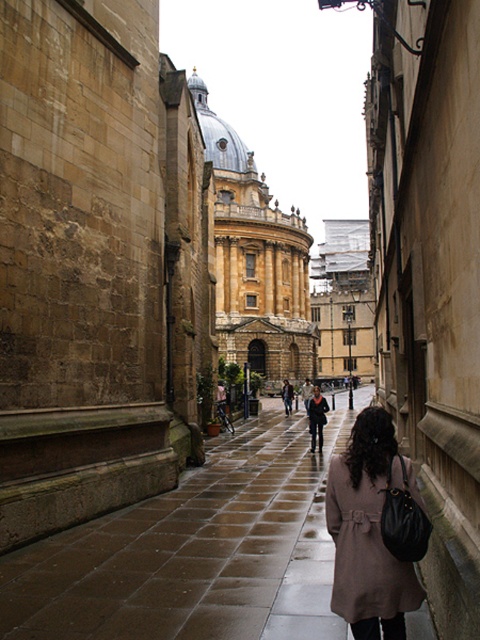
Is brown matte trench coat at lower right below matte black coat at center?

No.

Does brown matte trench coat at lower right have a greater height compared to matte black coat at center?

Yes, brown matte trench coat at lower right is taller than matte black coat at center.

Who is more forward, (381, 444) or (324, 401)?

Point (381, 444) is in front.

At what (x,y) coordinates should I click in order to perform the action: click on brown matte trench coat at lower right. Please return your answer as a coordinate pair (x, y). Looking at the image, I should click on (374, 531).

Does golden stone dome at center have a larger size compared to brown matte trench coat at lower right?

Yes, golden stone dome at center is bigger than brown matte trench coat at lower right.

Does point (232, 198) lie in front of point (408, 486)?

No, (232, 198) is further to viewer.

This screenshot has height=640, width=480. I want to click on golden stone dome at center, so click(x=255, y=260).

Can you confirm if golden stone dome at center is positioned to the left of matte black coat at center?

Indeed, golden stone dome at center is positioned on the left side of matte black coat at center.

Which is in front, point (243, 202) or point (308, 413)?

Point (308, 413) is in front.

Where is `golden stone dome at center`? This screenshot has width=480, height=640. golden stone dome at center is located at coordinates (255, 260).